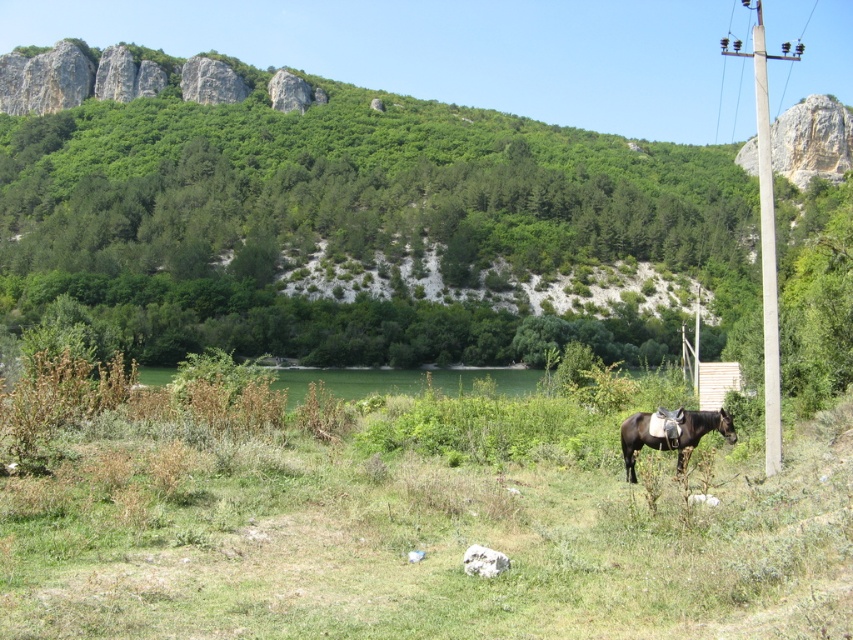
You are a hiker who wants to cross the water body in the midground. The horse is tied to the utility pole. Can you safely walk from the green grassy at center to the brown glossy horse at center without getting wet?

The distance between the green grassy at center and the brown glossy horse at center is 24.98 feet. Since the horse is tied to the utility pole, you can safely walk the 24.98 feet distance on the grassy area without needing to cross the water body.

You are planning to set up a small tent in the green grassy area at center. The tent requires a space wider than the brown glossy horse at center. Can the green grassy at center accommodate your tent?

The green grassy at center might be wider than the brown glossy horse at center, so it could potentially accommodate the tent if the grassy area is indeed wider. However, the exact width isn

You are a photographer aiming to capture a clear shot of the brown glossy horse at center without any obstructions. Given that the concrete pole at right is in the scene, can you position yourself so that the pole does not block the view of the horse?

The concrete pole at right is above the brown glossy horse at center, so positioning yourself lower or to the side might allow you to capture the horse without the pole obstructing the view.